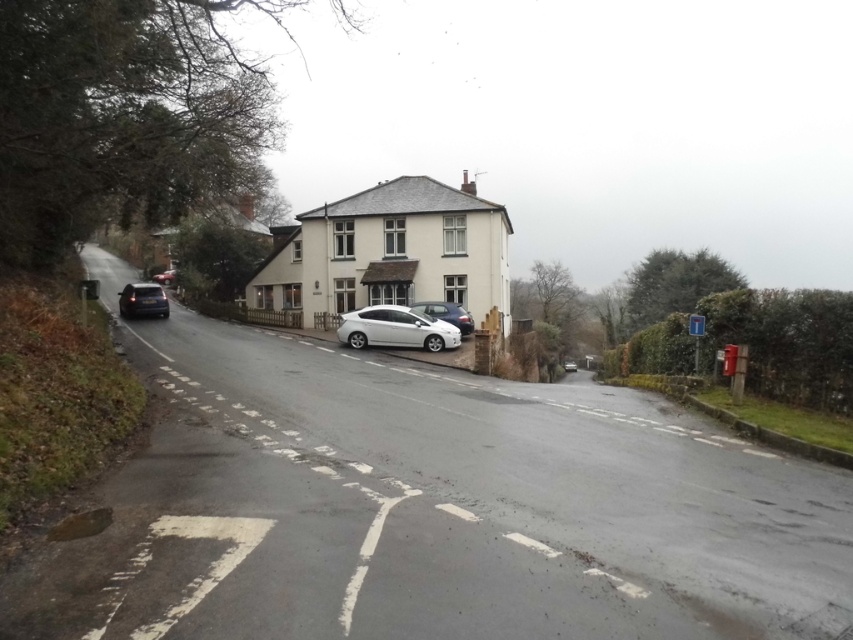
Looking at this image, you are a delivery driver who needs to park your truck between the satin white sedan at center and the satin silver sedan at center. Your truck is 2.2 meters tall. Can you park your truck there without hitting the roof?

The satin white sedan at center is taller than the satin silver sedan at center. Since the truck is 2.2 meters tall, you need to compare its height with the tallest vehicle. However, the exact heights aren not provided. Therefore, it is uncertain if the truck can park there without hitting the roof.

Consider the image. You are a delivery driver who needs to park your vehicle in the area shown in the image. The delivery van you are driving is 5 meters long. The parking spot at point (x=395, y=328) is 4 meters long. Can you park your van there?

The parking spot at point (x=395, y=328) is 4 meters long, so the van cannot be parked there since it is longer than the available space.